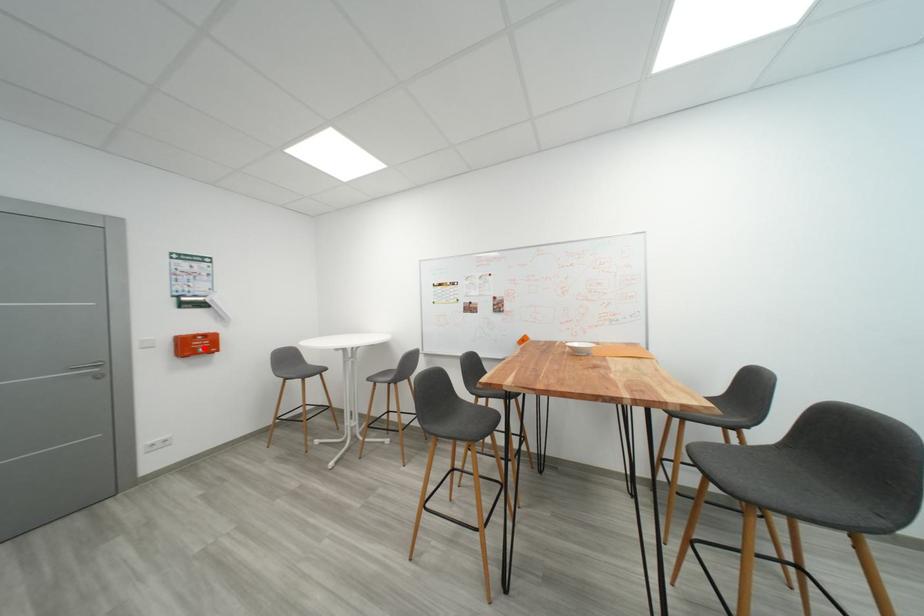
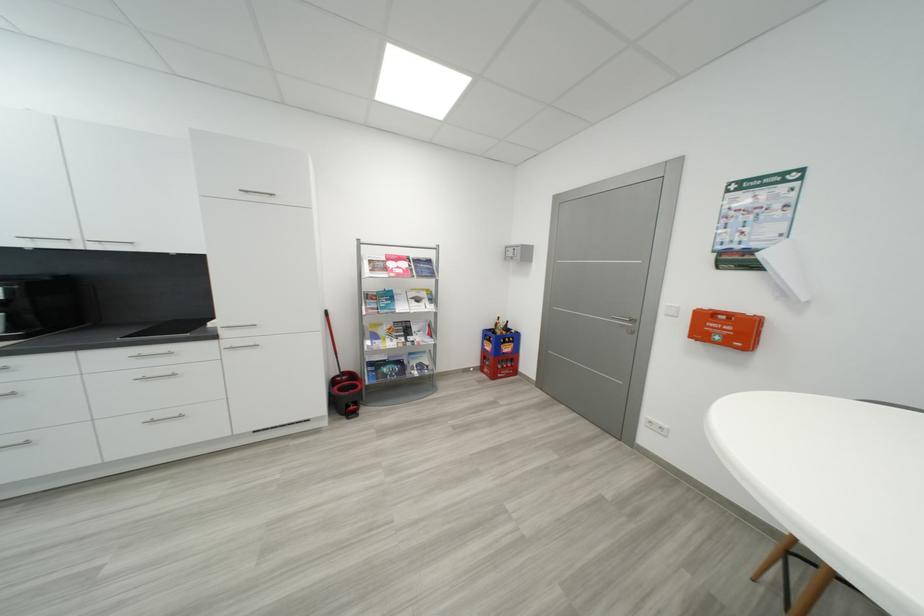
Where in the second image is the point corresponding to the highlighted location from the first image?

(733, 333)